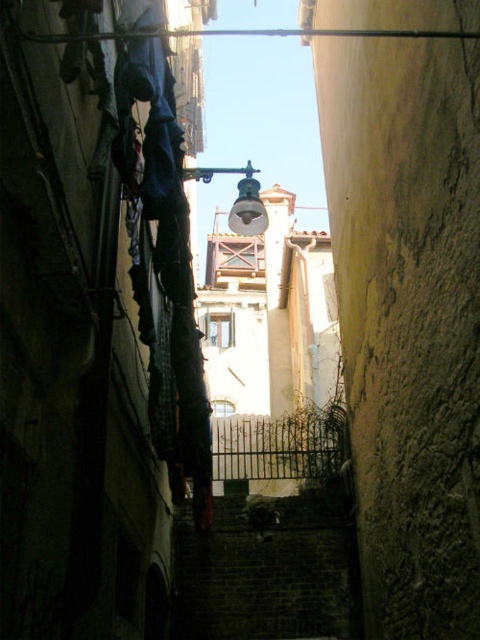
You are standing at the entrance of the alley and want to climb the dark brick stairwell at center. Which direction should you move relative to the metallic glass at upper center to reach it?

The dark brick stairwell at center is to the right of the metallic glass at upper center, so you should move to the right of the metallic glass at upper center to reach it.

You are a delivery person carrying a package and need to navigate through the alley. There is a dark brick stairwell at center and a metallic glass at upper center. Which object is shorter in height?

The dark brick stairwell at center has a lesser height compared to metallic glass at upper center, so the dark brick stairwell at center is shorter in height.